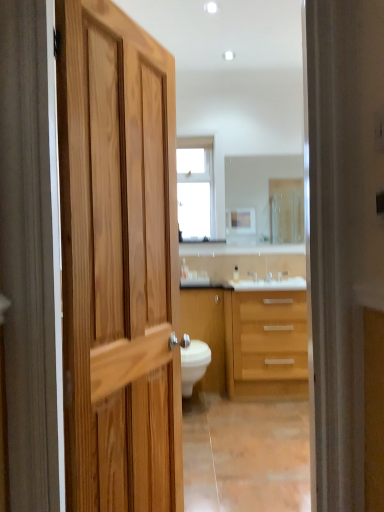
Question: Could you tell me if matte wood cabinet at center is turned towards clear glass mirror at center?

Choices:
 (A) no
 (B) yes

Answer: (A)

Question: Can you confirm if matte wood cabinet at center is bigger than clear glass mirror at center?

Choices:
 (A) no
 (B) yes

Answer: (B)

Question: Can you confirm if matte wood cabinet at center is smaller than clear glass mirror at center?

Choices:
 (A) yes
 (B) no

Answer: (B)

Question: Is the position of matte wood cabinet at center less distant than that of clear glass mirror at center?

Choices:
 (A) yes
 (B) no

Answer: (A)

Question: From a real-world perspective, is matte wood cabinet at center located higher than clear glass mirror at center?

Choices:
 (A) no
 (B) yes

Answer: (A)

Question: From the image's perspective, is light wood cabinet at center positioned above or below satin nickel faucet at center?

Choices:
 (A) above
 (B) below

Answer: (B)

Question: Which is correct: light wood cabinet at center is inside satin nickel faucet at center, or outside of it?

Choices:
 (A) outside
 (B) inside

Answer: (A)

Question: Is light wood cabinet at center bigger or smaller than satin nickel faucet at center?

Choices:
 (A) small
 (B) big

Answer: (B)

Question: In the image, is light wood cabinet at center on the left side or the right side of satin nickel faucet at center?

Choices:
 (A) left
 (B) right

Answer: (B)

Question: Looking at the image, does satin nickel faucet at center seem bigger or smaller compared to light wood cabinet at center?

Choices:
 (A) big
 (B) small

Answer: (B)

Question: Would you say satin nickel faucet at center is to the left or to the right of light wood cabinet at center in the picture?

Choices:
 (A) right
 (B) left

Answer: (B)

Question: In terms of width, does satin nickel faucet at center look wider or thinner when compared to light wood cabinet at center?

Choices:
 (A) thin
 (B) wide

Answer: (A)

Question: Which is correct: satin nickel faucet at center is inside light wood cabinet at center, or outside of it?

Choices:
 (A) outside
 (B) inside

Answer: (A)

Question: From the image's perspective, is matte wood cabinet at center above or below satin nickel faucet at center?

Choices:
 (A) below
 (B) above

Answer: (A)

Question: Considering the positions of point (215, 308) and point (256, 276), is point (215, 308) closer or farther from the camera than point (256, 276)?

Choices:
 (A) closer
 (B) farther

Answer: (A)